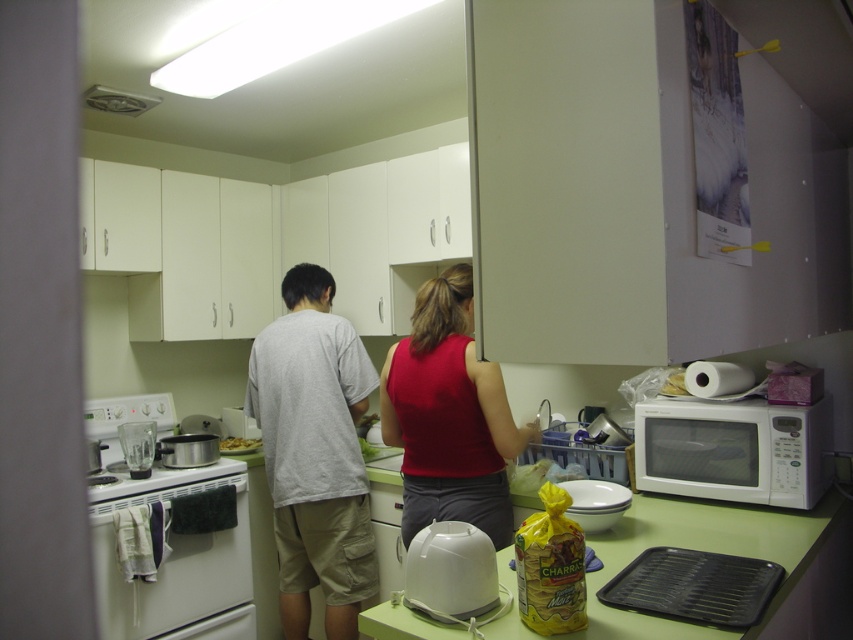
You are organizing the kitchen counter and need to place the white plastic plate at center to the left of the white plastic toaster at lower center. Is the current arrangement correct?

The white plastic toaster at lower center is already to the right of the white plastic plate at center, so the current arrangement is correct.